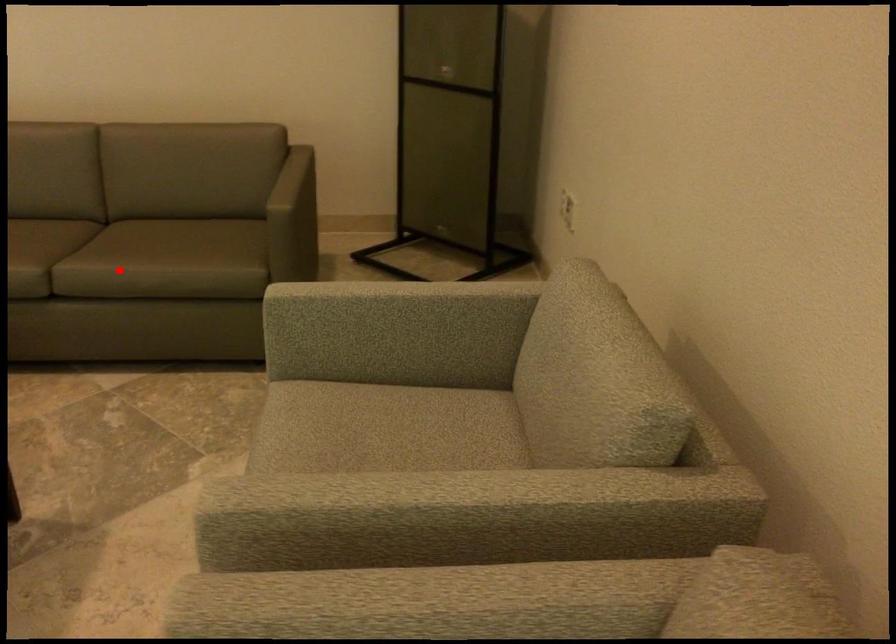
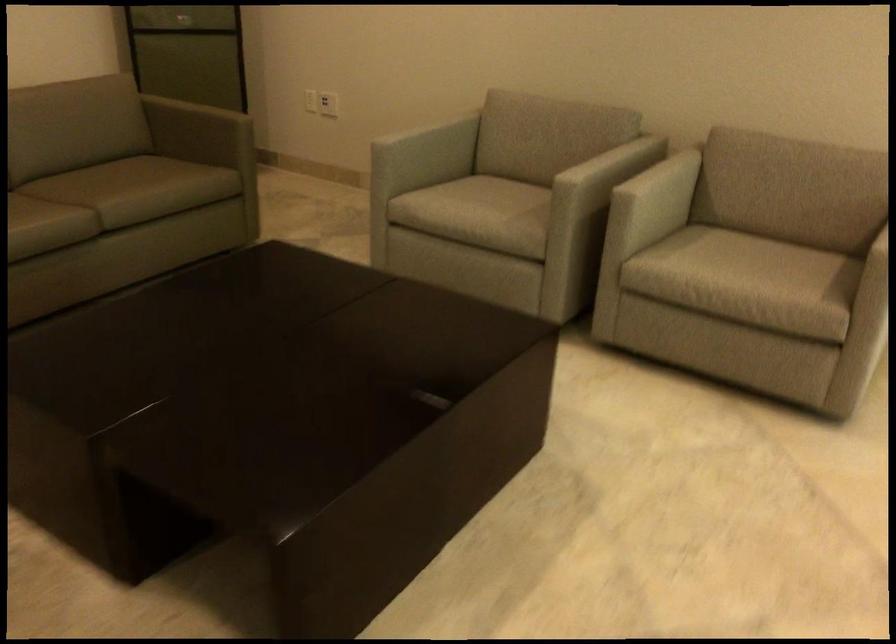
Question: I am providing you with two images of the same scene from different viewpoints. In image1, a red point is highlighted. Considering the same 3D point in image2, which of the following is correct?

Choices:
 (A) It is closer
 (B) It is farther

Answer: (B)